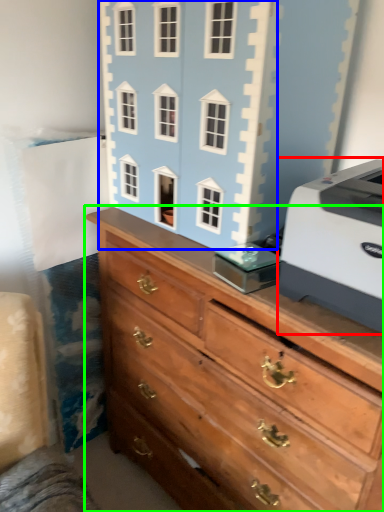
Question: Based on their relative distances, which object is nearer to printer (highlighted by a red box)? Choose from toy (highlighted by a blue box) and chest of drawers (highlighted by a green box).

Choices:
 (A) toy
 (B) chest of drawers

Answer: (B)